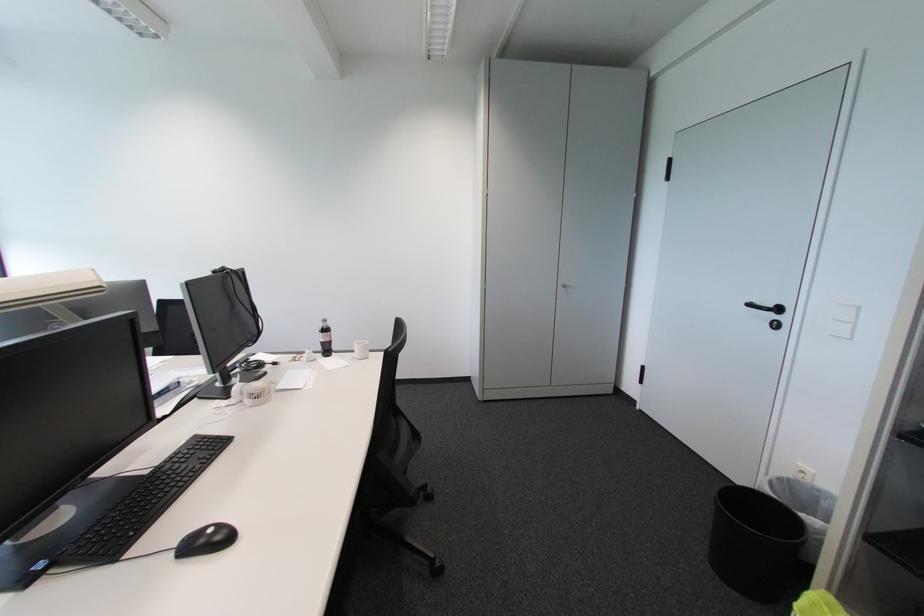
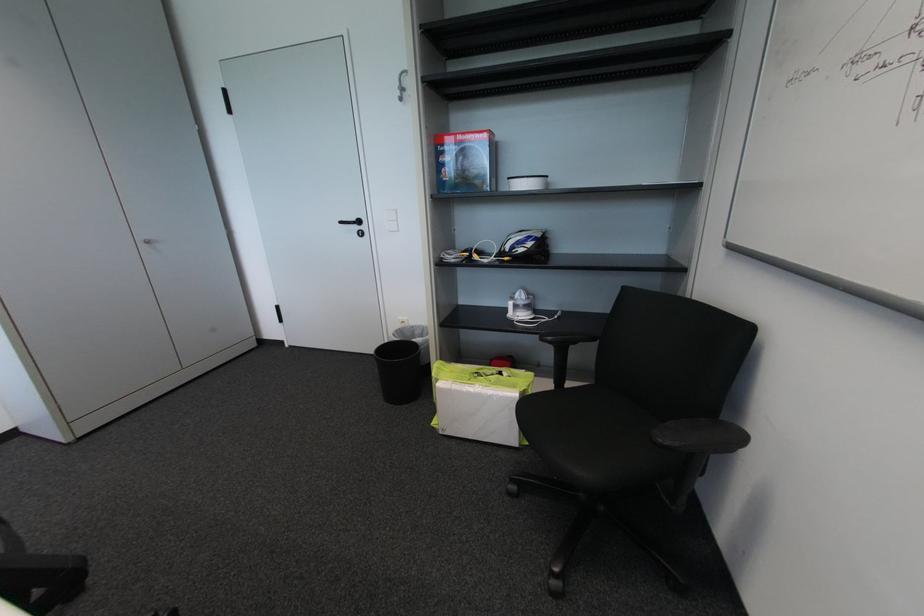
Locate, in the second image, the point that corresponds to [777,317] in the first image.

(362, 229)